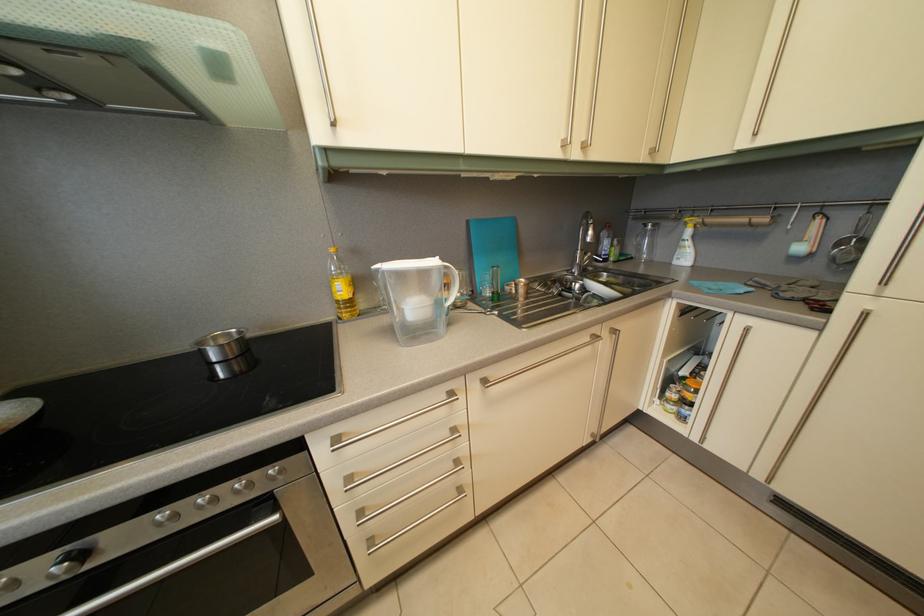
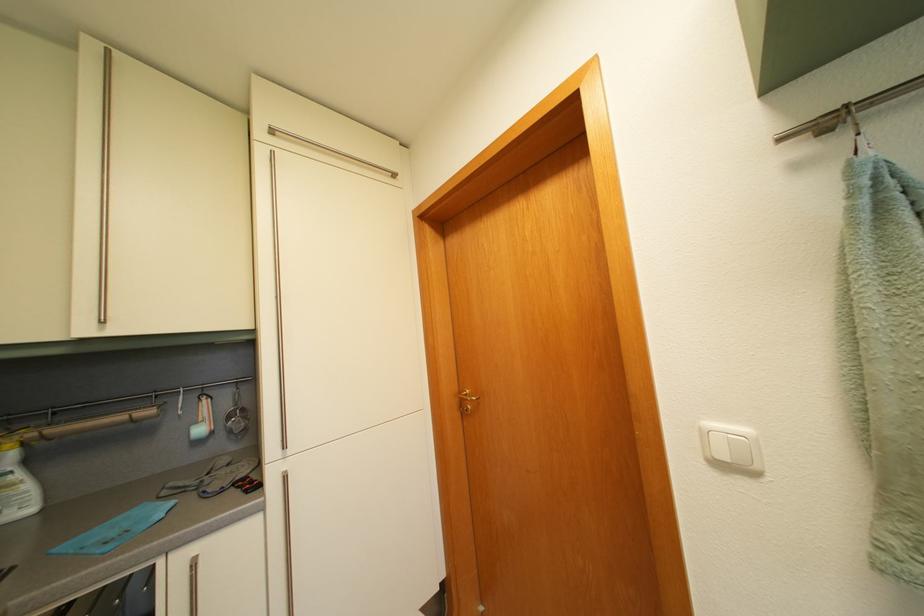
Locate, in the second image, the point that corresponds to point (808, 248) in the first image.

(204, 430)